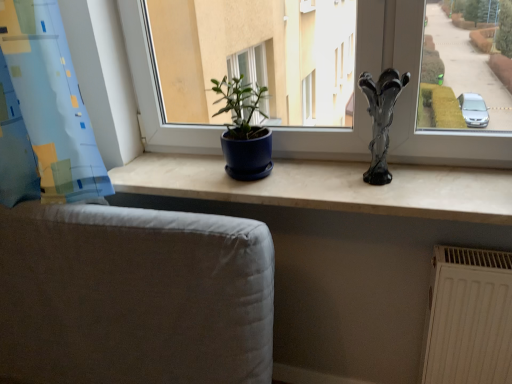
The height and width of the screenshot is (384, 512). Describe the element at coordinates (134, 296) in the screenshot. I see `gray fabric armchair at lower left` at that location.

Measure the distance between white textured radiator at lower right and camera.

white textured radiator at lower right and camera are 3.63 feet apart.

Identify the location of matte blue pot at center. (416, 89).

Locate an element on the screen. gray fabric armchair at lower left is located at coordinates (134, 296).

From the image's perspective, which one is positioned lower, gray fabric armchair at lower left or blue fabric curtain at left?

gray fabric armchair at lower left, from the image's perspective.

Is gray fabric armchair at lower left positioned before blue fabric curtain at left?

Yes, gray fabric armchair at lower left is closer to the camera.

Is gray fabric armchair at lower left far away from blue fabric curtain at left?

No, gray fabric armchair at lower left is in close proximity to blue fabric curtain at left.

Which of these two, white textured radiator at lower right or matte blue pot at center, is thinner?

Thinner between the two is white textured radiator at lower right.

Which is more to the left, white textured radiator at lower right or matte blue pot at center?

matte blue pot at center.

Image resolution: width=512 pixels, height=384 pixels. In order to click on houseplant lying behind the white textured radiator at lower right in this screenshot , I will do `click(244, 131)`.

Can you confirm if white textured radiator at lower right is taller than matte blue pot at center?

Correct, white textured radiator at lower right is much taller as matte blue pot at center.

Which object is further away from the camera, blue fabric curtain at left or transparent glass vase at right?

Positioned behind is transparent glass vase at right.

Considering the sizes of objects blue fabric curtain at left and transparent glass vase at right in the image provided, who is taller, blue fabric curtain at left or transparent glass vase at right?

blue fabric curtain at left is taller.

What's the angular difference between blue fabric curtain at left and transparent glass vase at right's facing directions?

blue fabric curtain at left and transparent glass vase at right are facing 0.00131 degrees away from each other.

In the scene shown: Is blue fabric curtain at left completely or partially outside of transparent glass vase at right?

Indeed, blue fabric curtain at left is completely outside transparent glass vase at right.

Are matte blue pot at center and blue fabric curtain at left far apart?

No, matte blue pot at center is in close proximity to blue fabric curtain at left.

From the image's perspective, is matte blue pot at center on top of blue fabric curtain at left?

Yes, from the image's perspective, matte blue pot at center is above blue fabric curtain at left.

Considering the relative positions of matte blue pot at center and blue fabric curtain at left in the image provided, is matte blue pot at center to the left or to the right of blue fabric curtain at left?

From the image, it's evident that matte blue pot at center is to the right of blue fabric curtain at left.

Can you confirm if matte blue pot at center is bigger than blue fabric curtain at left?

Actually, matte blue pot at center might be smaller than blue fabric curtain at left.

Considering the relative positions of transparent glass vase at right and gray fabric armchair at lower left in the image provided, is transparent glass vase at right to the left of gray fabric armchair at lower left from the viewer's perspective?

No.

What's the angular difference between transparent glass vase at right and gray fabric armchair at lower left's facing directions?

There is a 0.000861-degree angle between the facing directions of transparent glass vase at right and gray fabric armchair at lower left.

Looking at this image, is transparent glass vase at right wider than gray fabric armchair at lower left?

In fact, transparent glass vase at right might be narrower than gray fabric armchair at lower left.

From the image's perspective, is transparent glass vase at right above or below gray fabric armchair at lower left?

Clearly, from the image's perspective, transparent glass vase at right is above gray fabric armchair at lower left.

Does matte blue pot at center appear on the right side of white textured radiator at lower right?

No.

Is matte blue pot at center bigger than white textured radiator at lower right?

No.

Looking at this image, is matte blue pot at center positioned with its back to white textured radiator at lower right?

matte blue pot at center does not have its back to white textured radiator at lower right.

Is matte blue pot at center spatially inside white textured radiator at lower right, or outside of it?

matte blue pot at center is spatially situated outside white textured radiator at lower right.

Who is more distant, matte blue pot at center or matte blue pot at center?

matte blue pot at center is further from the camera.

From the picture: Is matte blue pot at center not within matte blue pot at center?

Yes, matte blue pot at center is located beyond the bounds of matte blue pot at center.

Can you tell me how much matte blue pot at center and matte blue pot at center differ in facing direction?

They differ by 0.000745 degrees in their facing directions.

Does matte blue pot at center have a smaller size compared to matte blue pot at center?

Indeed, matte blue pot at center has a smaller size compared to matte blue pot at center.

What are the coordinates of `curtain that is on the left side of gray fabric armchair at lower left` in the screenshot? It's located at (42, 112).

I want to click on radiator that is in front of the matte blue pot at center, so click(x=468, y=318).

Which object lies nearer to the anchor point matte blue pot at center, white textured radiator at lower right or matte blue pot at center?

Among the two, matte blue pot at center is located nearer to matte blue pot at center.

Estimate the real-world distances between objects in this image. Which object is further from matte blue pot at center, white textured radiator at lower right or transparent glass vase at right?

The object further to matte blue pot at center is white textured radiator at lower right.

Considering their positions, is white textured radiator at lower right positioned closer to blue fabric curtain at left than matte blue pot at center?

The object closer to blue fabric curtain at left is matte blue pot at center.

Which object lies further to the anchor point white textured radiator at lower right, matte blue pot at center or matte blue pot at center?

matte blue pot at center is positioned further to the anchor white textured radiator at lower right.

Considering their positions, is matte blue pot at center positioned further to transparent glass vase at right than matte blue pot at center?

matte blue pot at center is positioned further to the anchor transparent glass vase at right.

Looking at the image, which one is located further to gray fabric armchair at lower left, transparent glass vase at right or blue fabric curtain at left?

Among the two, transparent glass vase at right is located further to gray fabric armchair at lower left.

Looking at this image, based on their spatial positions, is blue fabric curtain at left or white textured radiator at lower right closer to matte blue pot at center?

blue fabric curtain at left is positioned closer to the anchor matte blue pot at center.

Which object lies nearer to the anchor point blue fabric curtain at left, matte blue pot at center or matte blue pot at center?

matte blue pot at center is closer to blue fabric curtain at left.

The height and width of the screenshot is (384, 512). In order to click on window located between matte blue pot at center and transparent glass vase at right in the left-right direction in this screenshot , I will do `click(416, 89)`.

Identify the location of counter top situated between blue fabric curtain at left and transparent glass vase at right from left to right. (328, 187).

What are the coordinates of `counter top between matte blue pot at center and white textured radiator at lower right in the horizontal direction` in the screenshot? It's located at (328, 187).

Locate an element on the screen. This screenshot has width=512, height=384. window between gray fabric armchair at lower left and transparent glass vase at right in the horizontal direction is located at coordinates coord(416,89).